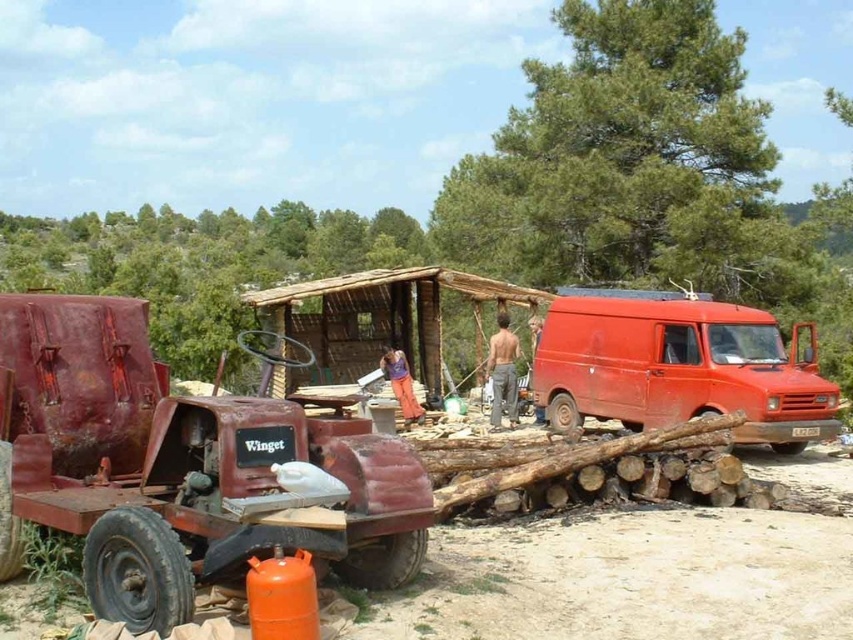
This screenshot has height=640, width=853. Identify the location of rusty metal trailer truck at left. (177, 467).

Between rusty metal trailer truck at left and skinny man at center, which one is positioned lower?

rusty metal trailer truck at left

Is point (364, 563) positioned after point (492, 376)?

No, (364, 563) is in front of (492, 376).

Find the location of a particular element. This screenshot has height=640, width=853. rusty metal trailer truck at left is located at coordinates [x=177, y=467].

Does matte red van at right appear under skinny man at center?

Yes, matte red van at right is below skinny man at center.

Can you confirm if matte red van at right is positioned above skinny man at center?

No.

Which is in front, point (724, 321) or point (503, 388)?

Point (724, 321)

Find the location of a particular element. This screenshot has width=853, height=640. matte red van at right is located at coordinates pos(679,368).

Does rusty metal trailer truck at left have a lesser width compared to matte red van at right?

Indeed, rusty metal trailer truck at left has a lesser width compared to matte red van at right.

The image size is (853, 640). What do you see at coordinates (177, 467) in the screenshot? I see `rusty metal trailer truck at left` at bounding box center [177, 467].

The height and width of the screenshot is (640, 853). Find the location of `rusty metal trailer truck at left`. rusty metal trailer truck at left is located at coordinates (177, 467).